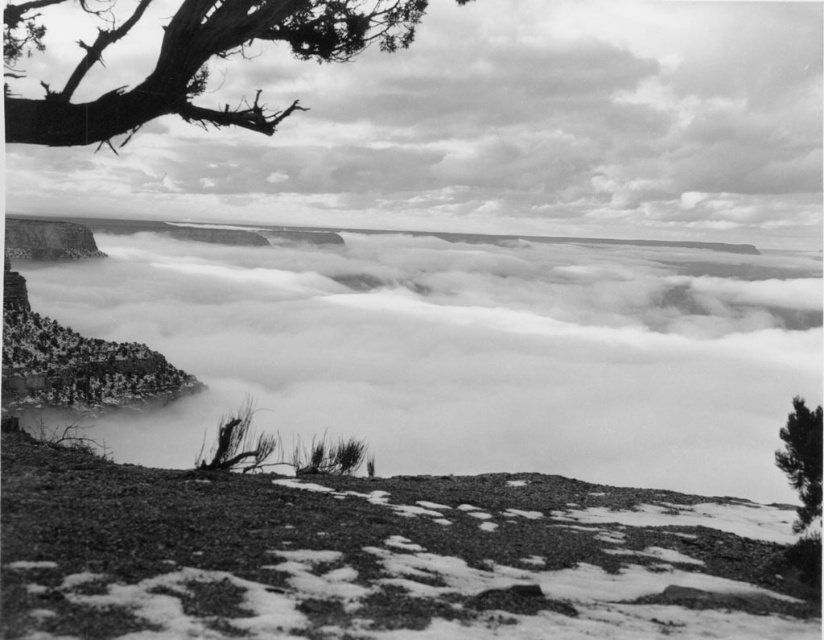
Where is `fuzzy white cloud at upper center`? fuzzy white cloud at upper center is located at coordinates [499, 129].

Does fuzzy white cloud at upper center appear under dead wood tree at upper left?

Actually, fuzzy white cloud at upper center is above dead wood tree at upper left.

At what (x,y) coordinates should I click in order to perform the action: click on fuzzy white cloud at upper center. Please return your answer as a coordinate pair (x, y). This screenshot has width=824, height=640. Looking at the image, I should click on (499, 129).

Can you confirm if rough textured dirt at lower center is bigger than dead wood tree at upper left?

No, rough textured dirt at lower center is not bigger than dead wood tree at upper left.

Who is positioned more to the right, rough textured dirt at lower center or dead wood tree at upper left?

Positioned to the right is rough textured dirt at lower center.

Does point (253, 545) lie in front of point (185, 67)?

Yes, point (253, 545) is closer to viewer.

This screenshot has height=640, width=824. Identify the location of rough textured dirt at lower center. (373, 557).

Does fuzzy white cloud at upper center appear under smooth bark tree at upper right?

Incorrect, fuzzy white cloud at upper center is not positioned below smooth bark tree at upper right.

Looking at this image, does fuzzy white cloud at upper center have a larger size compared to smooth bark tree at upper right?

Yes.

Locate an element on the screen. This screenshot has width=824, height=640. fuzzy white cloud at upper center is located at coordinates (499, 129).